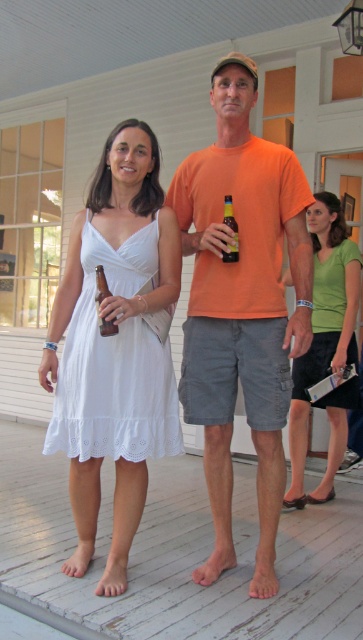
Question: Which point is farther from the camera taking this photo?

Choices:
 (A) (347, 244)
 (B) (227, 218)
 (C) (337, 368)

Answer: (A)

Question: Can you confirm if black textured fabric dress at lower right is positioned to the right of brown glass bottle at center?

Choices:
 (A) yes
 (B) no

Answer: (A)

Question: Which object is the farthest from the translucent glass bottle at center?

Choices:
 (A) orange cotton t-shirt at center
 (B) white lace dress at center
 (C) brown glass bottle at center
 (D) green matte shirt at upper right

Answer: (D)

Question: Does white lace dress at center appear under green matte shirt at upper right?

Choices:
 (A) no
 (B) yes

Answer: (A)

Question: Can you confirm if green matte shirt at upper right is positioned below translucent glass bottle at center?

Choices:
 (A) yes
 (B) no

Answer: (A)

Question: Which point is farther to the camera?

Choices:
 (A) (327, 317)
 (B) (336, 452)
 (C) (98, 269)

Answer: (B)